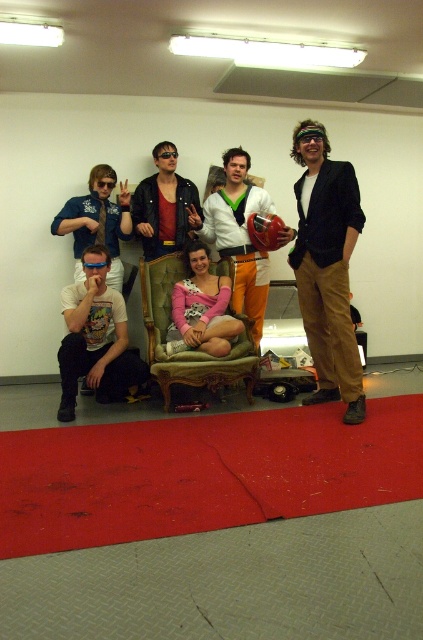
Based on the scene description, can you determine if the tufted fabric armchair at center is wider than the black plastic goggles at upper center?

The tufted fabric armchair at center is wider than the black plastic goggles at upper center because the description states that the armchair surpasses the goggles in width.

You are a photographer setting up for a group photo. You notice the matte black jacket at center and the black plastic goggles at upper center. Which object should you adjust to ensure both are fully visible in the frame?

The matte black jacket at center is in front of the black plastic goggles at upper center, so you should adjust the matte black jacket at center to move it out of the way so the goggles become visible.

You are a photographer setting up for a group photo. You notice two matte black blazer at right and matte black jacket at center in the scene. Which one has a taller silhouette?

The matte black blazer at right has a greater height compared to the matte black jacket at center, so it has a taller silhouette.